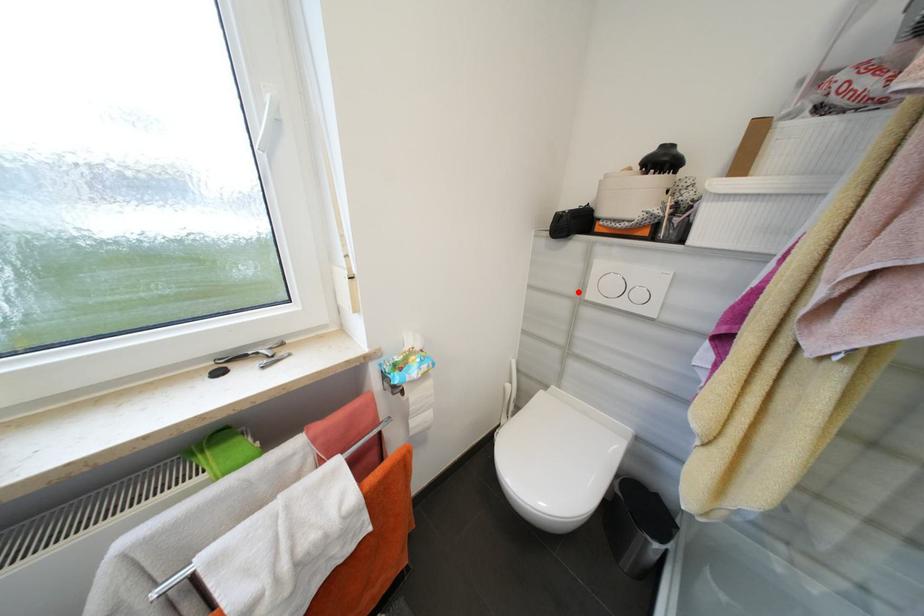
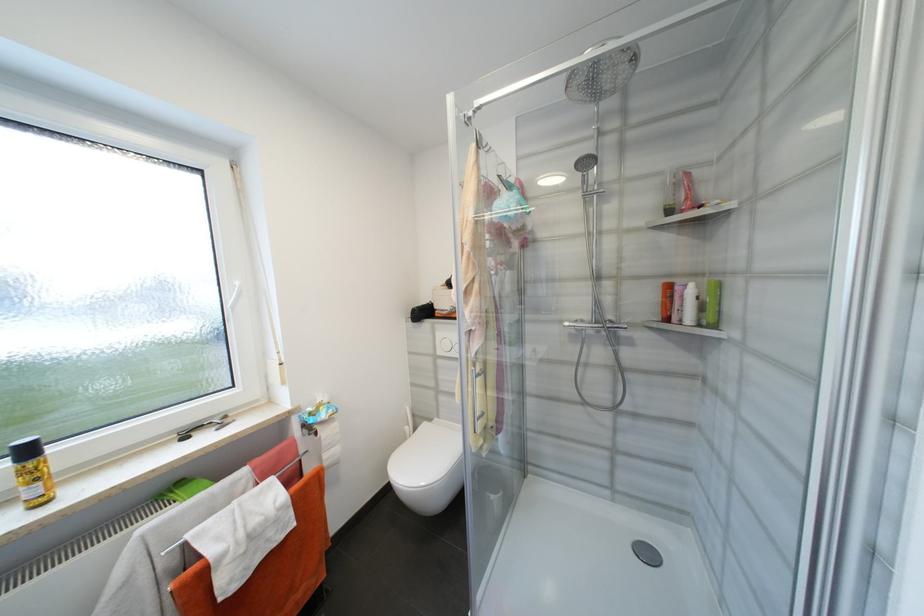
Question: I am providing you with two images of the same scene from different viewpoints. Image1 has a red point marked. In image2, the corresponding 3D location appears at what relative position? Reply with the corresponding letter.

Choices:
 (A) Closer
 (B) Farther

Answer: (B)